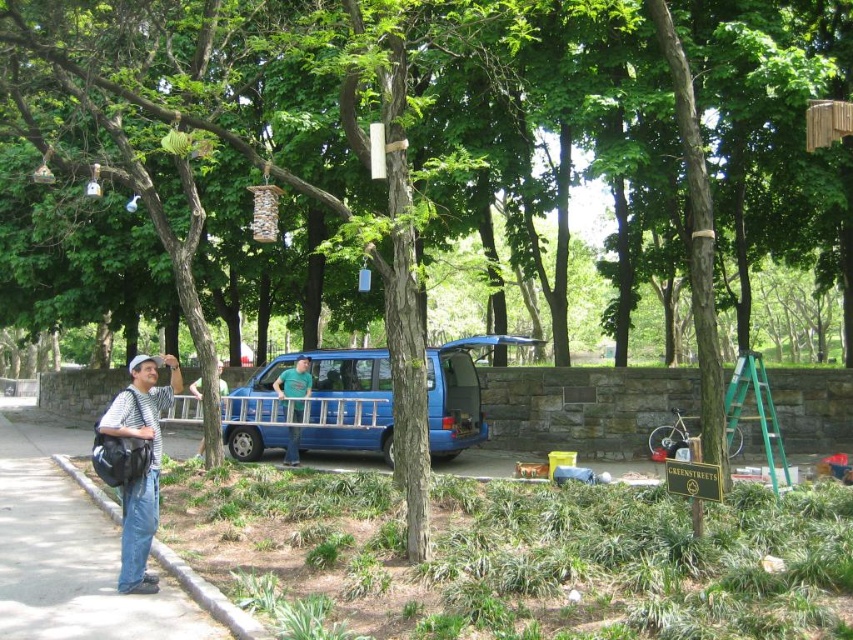
You are a hiker who just arrived at the park and see the striped cotton shirt at left and the green cotton shirt at center. Which shirt is nearer to you?

The striped cotton shirt at left is closer to the viewer than the green cotton shirt at center, so the striped cotton shirt at left is nearer to you.

You are a photographer trying to capture a photo of the striped cotton shirt at left and the gray concrete curb at lower left. Which object should you focus on first if you want to ensure both are in frame without moving the camera?

You should focus on the striped cotton shirt at left first because it is larger in size than the gray concrete curb at lower left, so it will be easier to frame and ensure both are included in the photo.

You are a photographer standing next to the blue matte van at center. You want to take a photo of a camera that is 13.25 meters away. Is the camera within the typical range of a standard camera lens?

The camera is 13.25 meters away from the blue matte van at center. A standard camera lens can focus on objects at that distance, so yes, the camera is within the typical range.